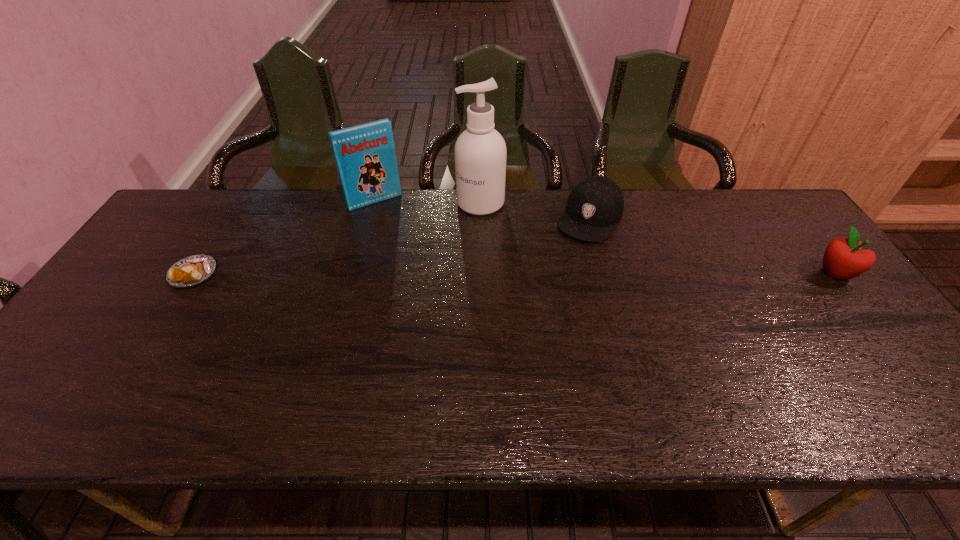
This screenshot has height=540, width=960. I want to click on the leftmost object, so click(x=192, y=270).

Where is `the shortest object`? The image size is (960, 540). the shortest object is located at coordinates (192, 270).

Where is `apple`? This screenshot has height=540, width=960. apple is located at coordinates (843, 258).

Where is `the third object from left to right`? This screenshot has height=540, width=960. the third object from left to right is located at coordinates (480, 152).

Locate an element on the screen. the tallest object is located at coordinates (480, 152).

Locate an element on the screen. the second object from right to left is located at coordinates [x=594, y=206].

Find the location of `the fourth object from right to left`. the fourth object from right to left is located at coordinates point(365,156).

You are a GUI agent. You are given a task and a screenshot of the screen. Output one action in this format:
    pyautogui.click(x=<x>, y=<y>)
    Task: Click on the second tallest object
    
    Given the screenshot: What is the action you would take?
    pyautogui.click(x=365, y=156)

Image resolution: width=960 pixels, height=540 pixels. In order to click on vacant space located on the back of the leftmost object in this screenshot , I will do `click(229, 219)`.

Image resolution: width=960 pixels, height=540 pixels. What are the coordinates of `free spot located 0.150m on the front label of the tallest object` in the screenshot? It's located at (445, 244).